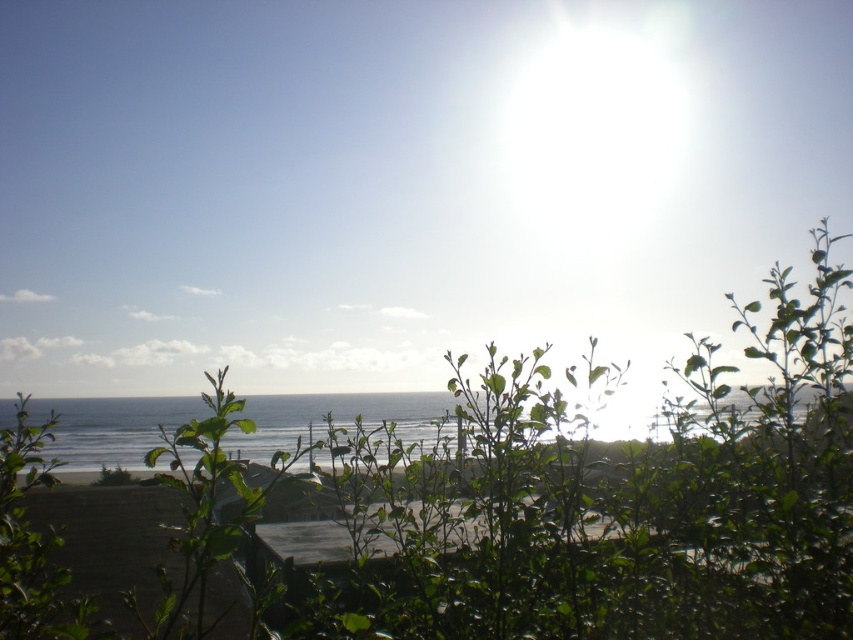
Does green leafy bush at center appear on the left side of clear blue water at center?

Correct, you'll find green leafy bush at center to the left of clear blue water at center.

Based on the photo, is green leafy bush at center thinner than clear blue water at center?

In fact, green leafy bush at center might be wider than clear blue water at center.

Where is `green leafy bush at center`? The height and width of the screenshot is (640, 853). green leafy bush at center is located at coordinates (491, 508).